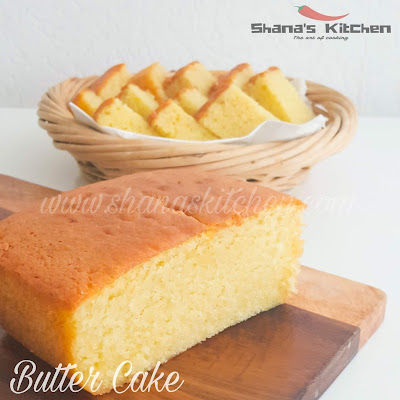
This screenshot has height=400, width=400. Find the location of `light gray smooth wall`. light gray smooth wall is located at coordinates point(147,43).